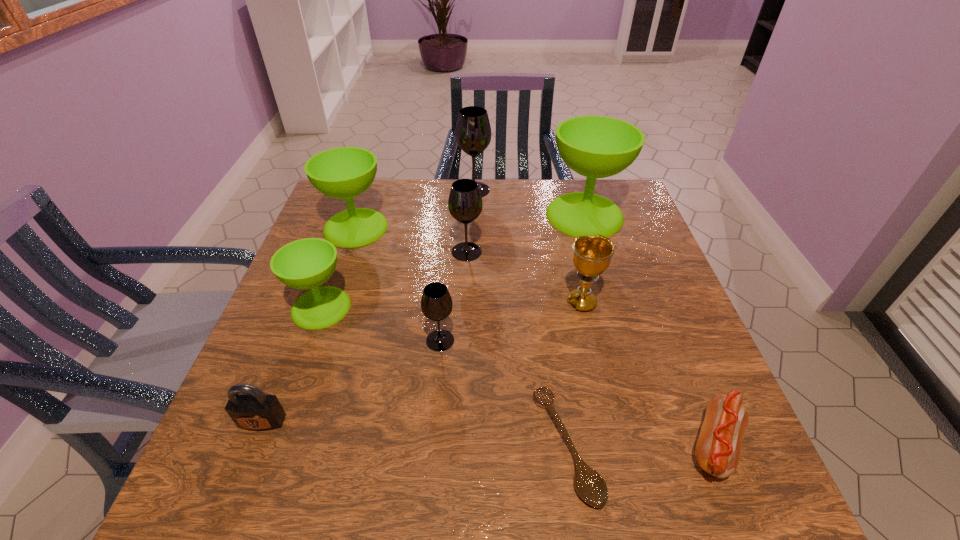
This screenshot has height=540, width=960. I want to click on object located at the near right corner, so click(718, 448).

Locate an element on the screen. Image resolution: width=960 pixels, height=540 pixels. vacant region at the far edge of the desktop is located at coordinates (391, 202).

Identify the location of vacant position at the near edge of the desktop. This screenshot has height=540, width=960. (557, 469).

This screenshot has width=960, height=540. Find the location of `free space at the left edge of the desktop`. free space at the left edge of the desktop is located at coordinates (274, 336).

The height and width of the screenshot is (540, 960). In the image, there is a desktop. In order to click on vacant space at the right edge in this screenshot , I will do `click(633, 372)`.

Where is `vacant area at the far left corner of the desktop`? Image resolution: width=960 pixels, height=540 pixels. vacant area at the far left corner of the desktop is located at coordinates (315, 221).

This screenshot has height=540, width=960. In the image, there is a desktop. In order to click on vacant space at the near right corner in this screenshot , I will do `click(745, 463)`.

You are a GUI agent. You are given a task and a screenshot of the screen. Output one action in this format:
    pyautogui.click(x=<x>, y=<y>)
    Task: Click on the unoccupied position between the second shortest object and the eighth tallest object
    The height and width of the screenshot is (540, 960).
    Given the screenshot: What is the action you would take?
    pyautogui.click(x=489, y=434)

This screenshot has height=540, width=960. Find the location of `vacant region between the brown sausage and the second biggest green wineglass`. vacant region between the brown sausage and the second biggest green wineglass is located at coordinates (536, 336).

Where is `empty space between the nearest gray wineglass and the second biggest green wineglass`? This screenshot has height=540, width=960. empty space between the nearest gray wineglass and the second biggest green wineglass is located at coordinates (398, 284).